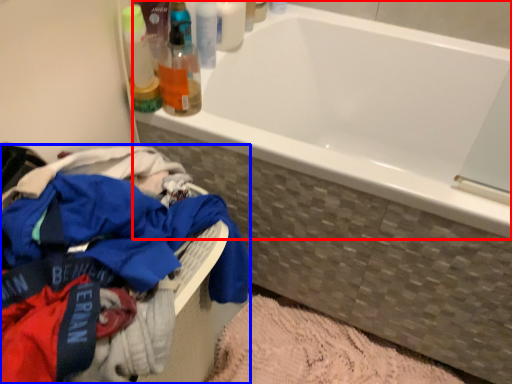
Question: Which object appears closest to the camera in this image, bathtub (highlighted by a red box) or clothing (highlighted by a blue box)?

Choices:
 (A) bathtub
 (B) clothing

Answer: (B)